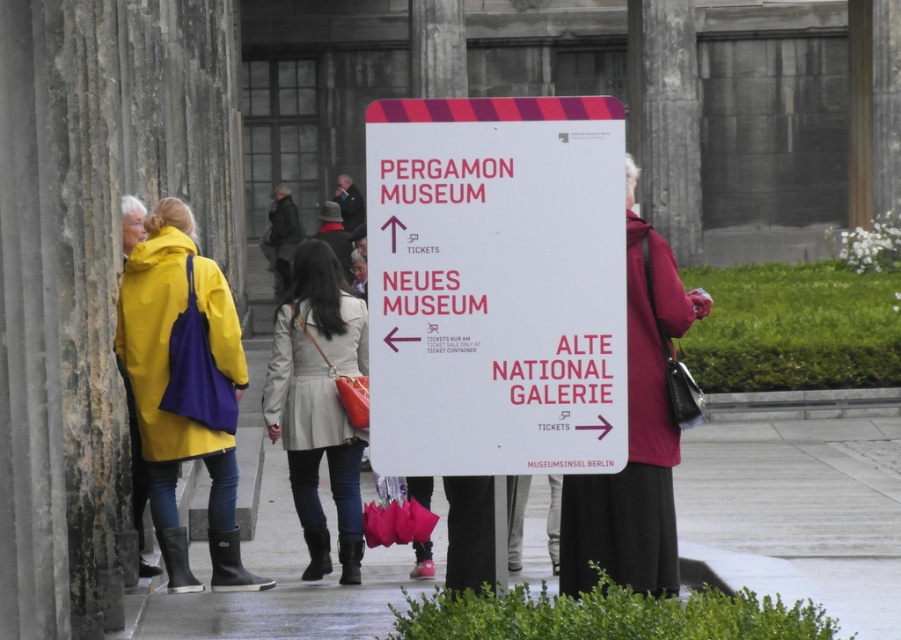
Does yellow matte coat at left come behind light beige leather coat at center?

No, yellow matte coat at left is in front of light beige leather coat at center.

Is point (214, 561) positioned in front of point (344, 422)?

Yes, it is.

Identify the location of yellow matte coat at left. This screenshot has width=901, height=640. (184, 387).

Which is in front, point (435, 337) or point (661, 412)?

Point (435, 337) is more forward.

Does point (484, 246) come farther from viewer compared to point (663, 474)?

No.

This screenshot has width=901, height=640. I want to click on white paper sign at center, so click(496, 285).

Locate an element on the screen. This screenshot has height=640, width=901. white paper sign at center is located at coordinates (496, 285).

In the scene shown: Can you confirm if white paper sign at center is smaller than yellow matte coat at left?

Indeed, white paper sign at center has a smaller size compared to yellow matte coat at left.

Is point (484, 166) in front of point (220, 474)?

Yes, point (484, 166) is closer to viewer.

Identify the location of white paper sign at center. Image resolution: width=901 pixels, height=640 pixels. (496, 285).

This screenshot has width=901, height=640. What are the coordinates of `white paper sign at center` in the screenshot? It's located at (496, 285).